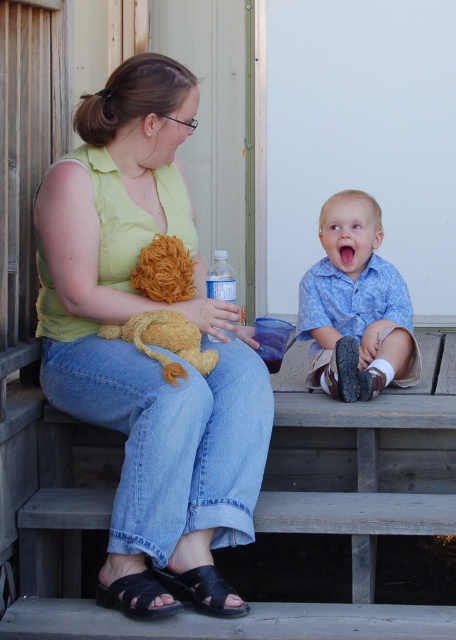
Question: Is blue cotton shirt at lower right closer to camera compared to clear plastic bottle at center?

Choices:
 (A) yes
 (B) no

Answer: (B)

Question: Which point appears farthest from the camera in this image?

Choices:
 (A) (185, 600)
 (B) (218, 410)
 (C) (347, 272)
 (D) (171, 368)

Answer: (C)

Question: Which point is closer to the camera?

Choices:
 (A) fluffy yellow stuffed animal at center
 (B) matte yellow shirt at center

Answer: (B)

Question: Can you confirm if black suede sandal at lower center is bigger than clear plastic bottle at center?

Choices:
 (A) no
 (B) yes

Answer: (A)

Question: Is matte yellow shirt at center positioned before black suede sandal at lower center?

Choices:
 (A) yes
 (B) no

Answer: (B)

Question: Which point appears closest to the camera in this image?

Choices:
 (A) (399, 289)
 (B) (217, 262)
 (C) (170, 358)
 (D) (233, 387)

Answer: (C)